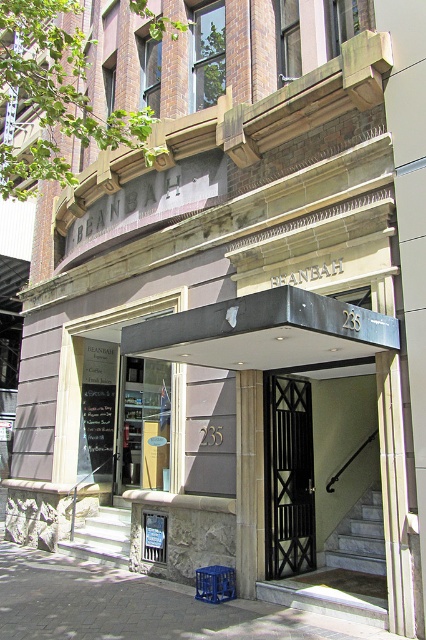
You are a delivery person approaching the entrance of BEANBAH. You see the paved stone pavement at lower center and the clear glass door at center. Which object is closer to you as you approach the entrance?

The paved stone pavement at lower center is closer to you as you approach the entrance because it is in front of the clear glass door at center.

You are standing at the entrance of BEANBAH building and want to walk towards the smooth stone column at center. Which direction should you move relative to your current position on the paved stone pavement at lower center?

The paved stone pavement at lower center is in front of the smooth stone column at center, so you should move forward from the paved stone pavement at lower center to reach the smooth stone column at center.